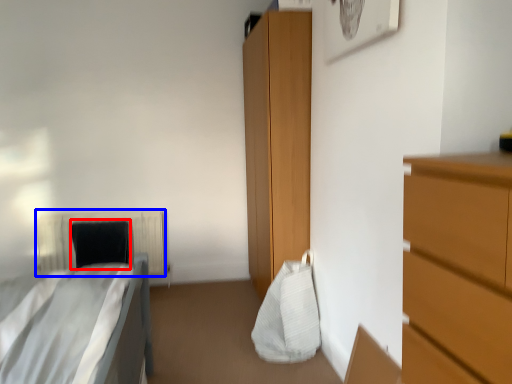
Question: Which of the following is the closest to the observer, pillow (highlighted by a red box) or radiator (highlighted by a blue box)?

Choices:
 (A) pillow
 (B) radiator

Answer: (A)